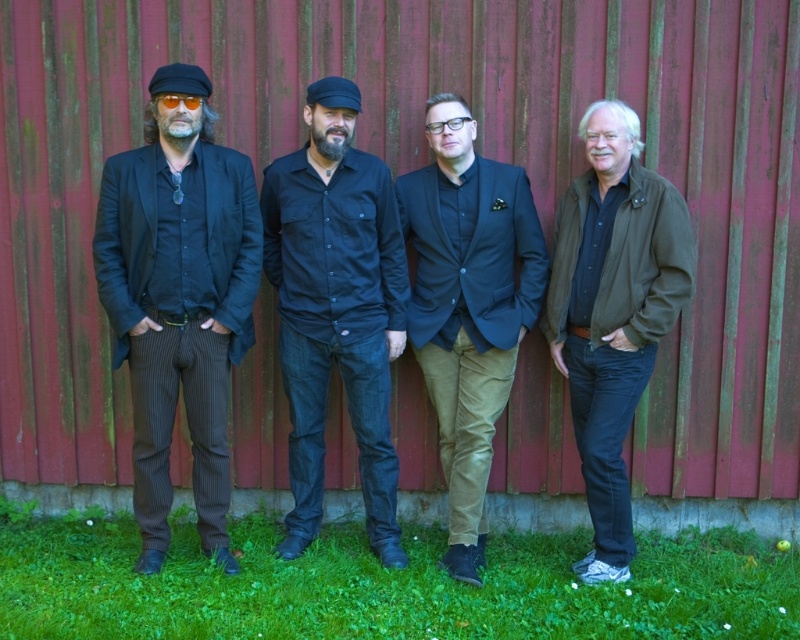
You are standing in front of the group of people. Which person is wearing the black pinstripe suit at left and where are they positioned relative to the person in black denim jeans at center?

The black pinstripe suit at left is worn by the first person from the left, positioned to the left of the person in black denim jeans at center.

You are a photographer trying to frame two people in the image for a group photo. The subjects are the black pinstripe suit at left and the matte black blazer at center. Since you want them to appear similar in size in the final photo, which subject should you move closer to the camera?

You should move the matte black blazer at center closer to the camera because the black pinstripe suit at left is larger in size. By moving the smaller matte black blazer at center forward, their sizes in the photo will appear more balanced.

You are standing in front of the group of people against the red wall. Which of the two, the black pinstripe suit at left or the dark brown leather jacket at right, is positioned closer to your left side?

The black pinstripe suit at left is positioned closer to your left side because it is to the left of the dark brown leather jacket at right.